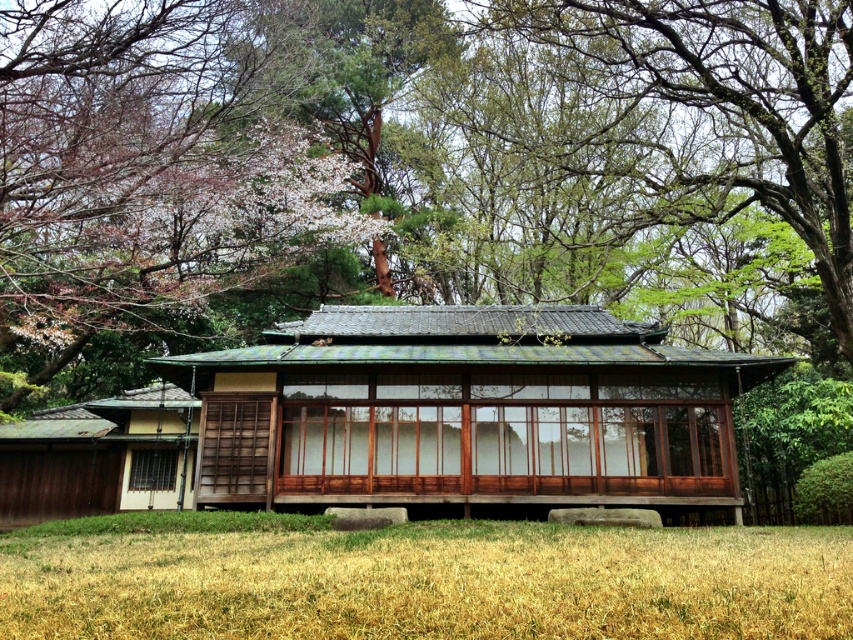
Which is more to the left, green leafy tree at upper center or wooden gazebo at center?

wooden gazebo at center is more to the left.

Is green leafy tree at upper center positioned behind wooden gazebo at center?

That is False.

Who is more distant from viewer, [672,51] or [554,458]?

Point [554,458]

What are the coordinates of `green leafy tree at upper center` in the screenshot? It's located at [x=422, y=160].

Does green leafy tree at upper center appear on the right side of dry grass at lower center?

Yes, green leafy tree at upper center is to the right of dry grass at lower center.

Which is in front, point (566, 93) or point (277, 548)?

Point (277, 548) is more forward.

Image resolution: width=853 pixels, height=640 pixels. In order to click on green leafy tree at upper center in this screenshot , I will do `click(422, 160)`.

Who is positioned more to the left, wooden gazebo at center or dry grass at lower center?

Positioned to the left is dry grass at lower center.

What do you see at coordinates (468, 410) in the screenshot? I see `wooden gazebo at center` at bounding box center [468, 410].

The width and height of the screenshot is (853, 640). I want to click on wooden gazebo at center, so click(468, 410).